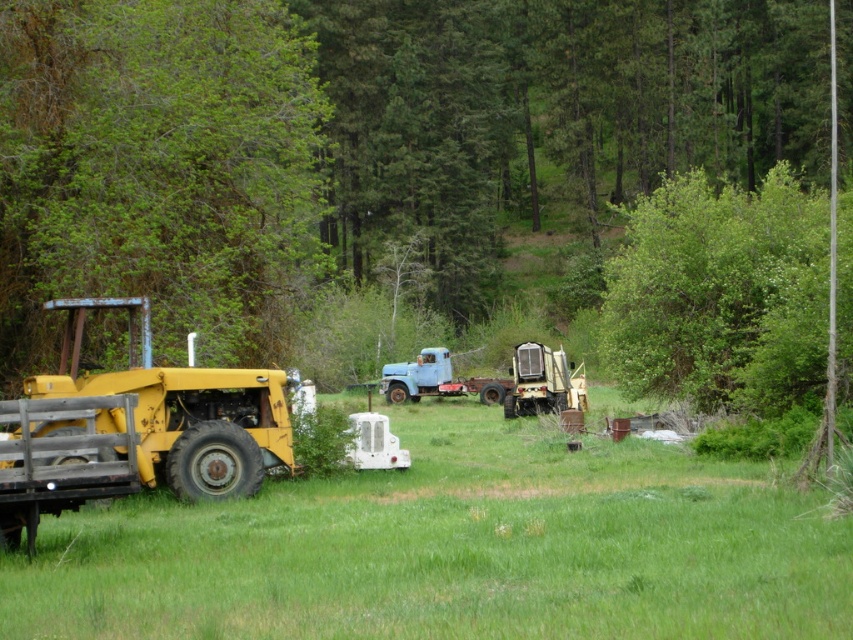
Who is higher up, green grassy field at lower left or green leafy tree at left?

green leafy tree at left

Can you confirm if green grassy field at lower left is smaller than green leafy tree at left?

Yes.

You are a GUI agent. You are given a task and a screenshot of the screen. Output one action in this format:
    pyautogui.click(x=<x>, y=<y>)
    Task: Click on the green grassy field at lower left
    
    Given the screenshot: What is the action you would take?
    pyautogui.click(x=454, y=548)

Find the location of a particular element. The image size is (853, 640). green grassy field at lower left is located at coordinates (454, 548).

Who is positioned more to the right, green leafy tree at center or light blue matte truck at center?

green leafy tree at center

Who is more forward, (163, 323) or (402, 397)?

Positioned in front is point (163, 323).

Does point (846, 38) lie behind point (416, 381)?

That is True.

This screenshot has width=853, height=640. What are the coordinates of `green leafy tree at center` in the screenshot? It's located at (358, 141).

Identify the location of green leafy tree at center. Image resolution: width=853 pixels, height=640 pixels. (358, 141).

What do you see at coordinates (358, 141) in the screenshot?
I see `green leafy tree at center` at bounding box center [358, 141].

Identify the location of green leafy tree at center. (358, 141).